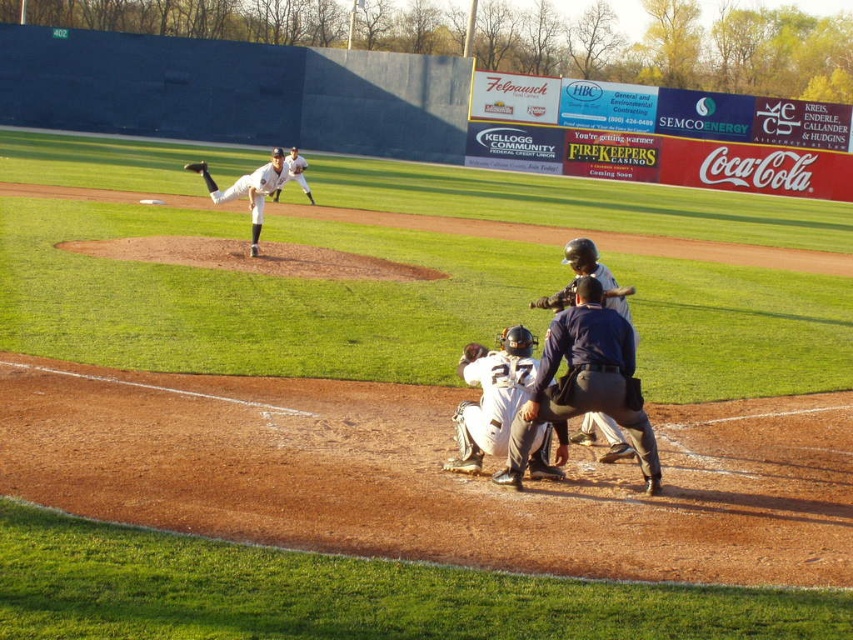
Which of these two, dark blue uniform at center or white uniform at center, stands shorter?

dark blue uniform at center is shorter.

At what (x,y) coordinates should I click in order to perform the action: click on dark blue uniform at center. Please return your answer as a coordinate pair (x, y). The width and height of the screenshot is (853, 640). Looking at the image, I should click on (585, 381).

Is dark blue uniform at center further to the viewer compared to brown leather glove at upper center?

That is False.

Who is shorter, dark blue uniform at center or brown leather glove at upper center?

dark blue uniform at center is shorter.

Which is in front, point (641, 440) or point (201, 168)?

Point (641, 440) is more forward.

At what (x,y) coordinates should I click in order to perform the action: click on dark blue uniform at center. Please return your answer as a coordinate pair (x, y). The height and width of the screenshot is (640, 853). Looking at the image, I should click on (585, 381).

Does matte blue umpire at center appear on the left side of white uniformed pitcher at center?

Incorrect, matte blue umpire at center is not on the left side of white uniformed pitcher at center.

Can you confirm if matte blue umpire at center is positioned below white uniformed pitcher at center?

Yes, matte blue umpire at center is below white uniformed pitcher at center.

The image size is (853, 640). In order to click on matte blue umpire at center in this screenshot , I will do `click(584, 275)`.